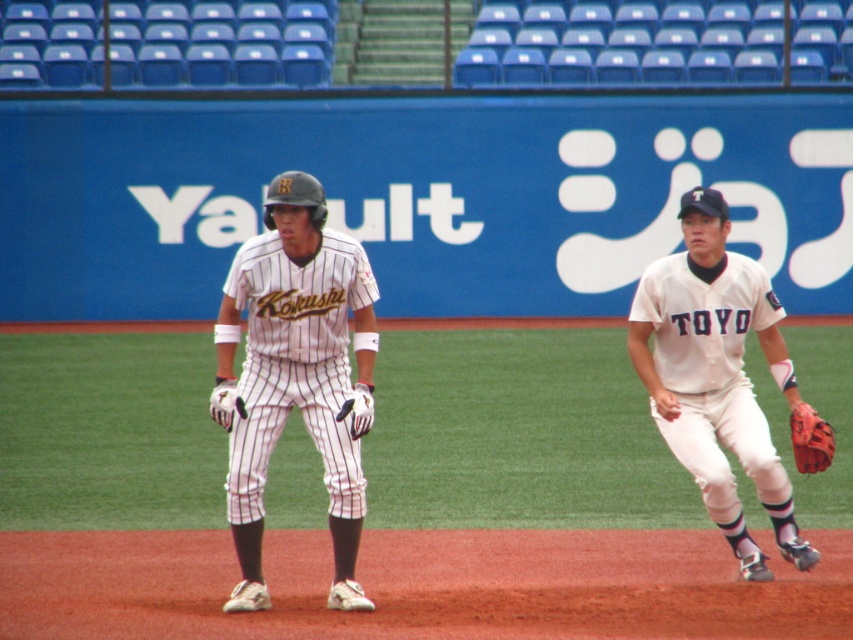
Question: Which of the following is the closest to the observer?

Choices:
 (A) white leather glove at center
 (B) white pinstriped uniform at center

Answer: (B)

Question: Can you confirm if white pinstriped uniform at center is wider than white synthetic glove at center?

Choices:
 (A) no
 (B) yes

Answer: (B)

Question: Can you confirm if white pinstriped uniform at center is positioned to the right of white synthetic glove at center?

Choices:
 (A) no
 (B) yes

Answer: (A)

Question: Which point is closer to the camera?

Choices:
 (A) white pinstriped uniform at center
 (B) leather textured glove at right

Answer: (A)

Question: Which of the following is the farthest from the observer?

Choices:
 (A) white leather glove at center
 (B) white matte baseball uniform at right
 (C) white synthetic glove at center

Answer: (B)

Question: Does white pinstriped uniform at center lie behind white leather glove at center?

Choices:
 (A) yes
 (B) no

Answer: (B)